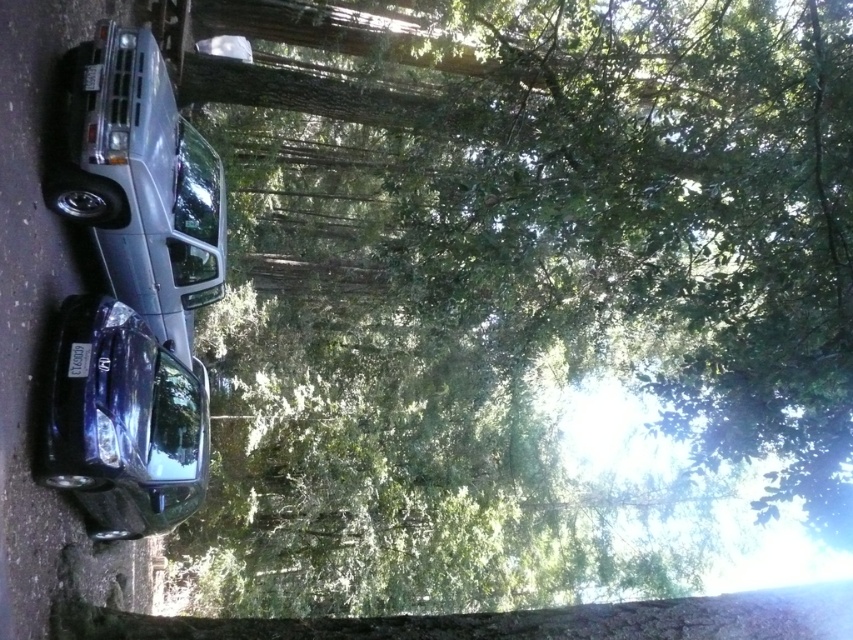
Does satin silver suv at left appear over glossy metallic car at lower left?

Yes.

Is the position of satin silver suv at left less distant than that of glossy metallic car at lower left?

No, it is not.

Locate an element on the screen. This screenshot has width=853, height=640. satin silver suv at left is located at coordinates (141, 182).